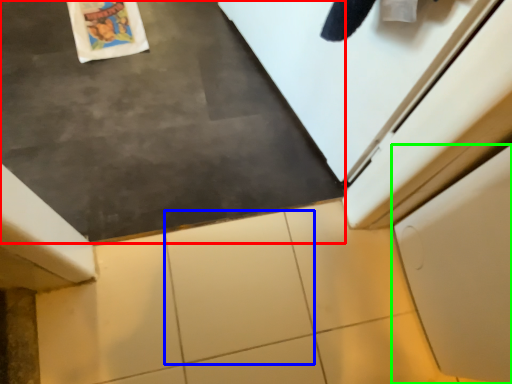
Question: Which object is the farthest from slate (highlighted by a red box)? Choose among these: granite (highlighted by a blue box) or cabinetry (highlighted by a green box).

Choices:
 (A) granite
 (B) cabinetry

Answer: (B)